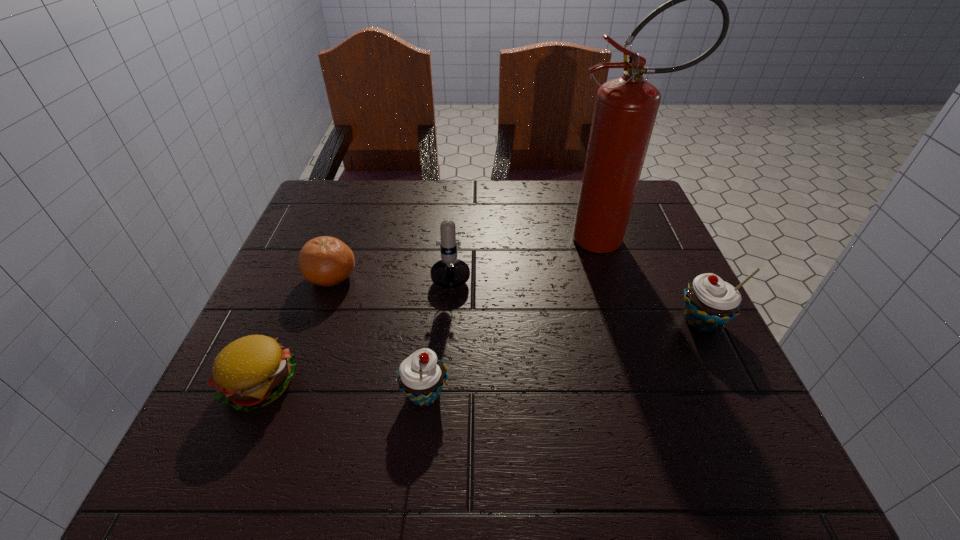
You are a GUI agent. You are given a task and a screenshot of the screen. Output one action in this format:
    pyautogui.click(x=<x>, y=<y>)
    Task: Click on the hamburger situated at the left edge
    The width and height of the screenshot is (960, 540).
    Given the screenshot: What is the action you would take?
    pyautogui.click(x=253, y=371)

The height and width of the screenshot is (540, 960). I want to click on cupcake at the right edge, so click(710, 302).

Locate an element on the screen. fire extinguisher situated at the right edge is located at coordinates (625, 110).

Where is `object positioned at the near left corner`? Image resolution: width=960 pixels, height=540 pixels. object positioned at the near left corner is located at coordinates pyautogui.click(x=253, y=371).

Identify the location of object present at the far right corner. The image size is (960, 540). (625, 110).

This screenshot has height=540, width=960. In the image, there is a desktop. Find the location of `vacant space at the far edge`. vacant space at the far edge is located at coordinates (421, 205).

The height and width of the screenshot is (540, 960). Identify the location of vacant space at the near edge of the desktop. (461, 392).

Locate an element on the screen. The width and height of the screenshot is (960, 540). vacant space at the left edge is located at coordinates (329, 236).

In the image, there is a desktop. Find the location of `vacant space at the right edge`. vacant space at the right edge is located at coordinates (630, 235).

The height and width of the screenshot is (540, 960). In the image, there is a desktop. What are the coordinates of `vacant space at the far left corner` in the screenshot? It's located at (313, 220).